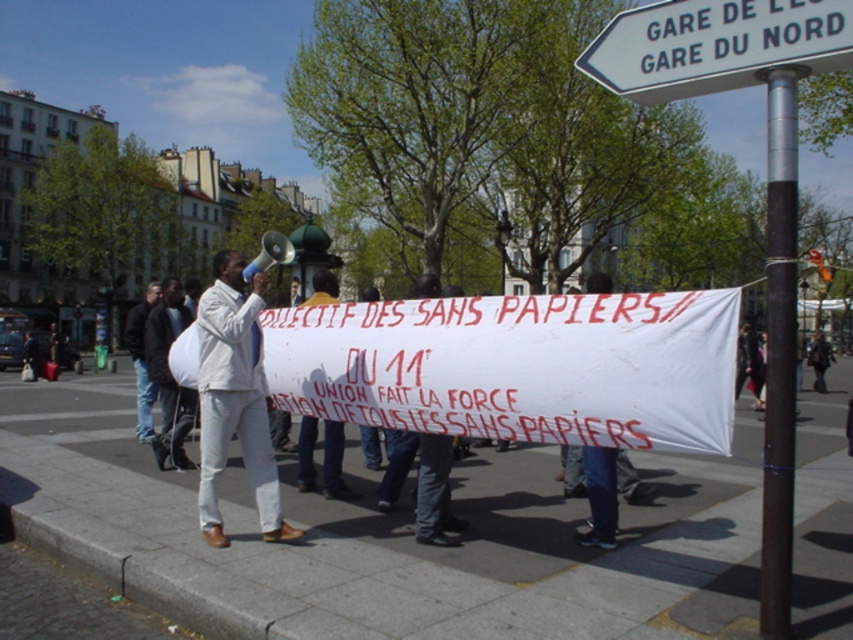
Does point (701, 26) come farther from viewer compared to point (155, 324)?

That is False.

Is white plastic sign at upper center above white fabric bag at center?

Yes, white plastic sign at upper center is above white fabric bag at center.

Who is more forward, (663, 26) or (161, 353)?

Point (663, 26)

Find the location of a particular element. white plastic sign at upper center is located at coordinates (715, 45).

Which is in front, point (215, 592) or point (140, 342)?

Point (215, 592) is in front.

Where is `gray concrete pavement at lower center`? gray concrete pavement at lower center is located at coordinates (375, 538).

Does white plastic sign at upper center appear under dark brown polished metal pole at upper right?

No.

The height and width of the screenshot is (640, 853). Find the location of `white plastic sign at upper center`. white plastic sign at upper center is located at coordinates (715, 45).